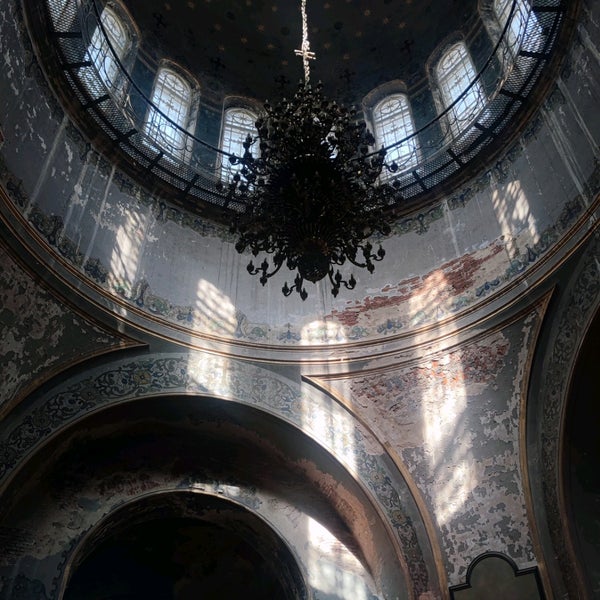
At what (x,y) coordinates should I click in order to perform the action: click on candles. Please return your answer as a coordinate pair (x, y). This screenshot has height=600, width=600. Looking at the image, I should click on pos(385,149), pos(250,264), pos(268,105).